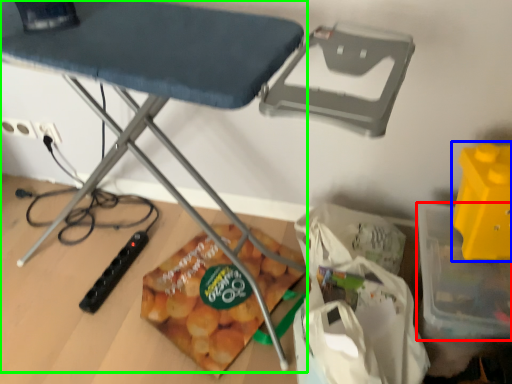
Question: Which is nearer to the storage box (highlighted by a red box)? toy (highlighted by a blue box) or table (highlighted by a green box).

Choices:
 (A) toy
 (B) table

Answer: (A)